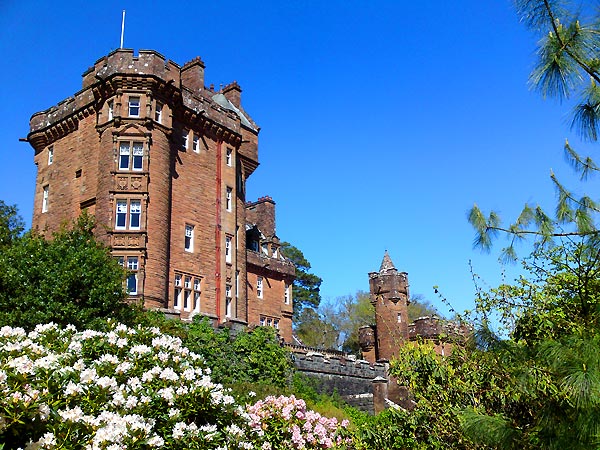
You are a GUI agent. You are given a task and a screenshot of the screen. Output one action in this format:
    pyautogui.click(x=<x>, y=<y>)
    Task: Click on the tower window
    This screenshot has width=600, height=450.
    Given the screenshot: What is the action you would take?
    pyautogui.click(x=397, y=320)